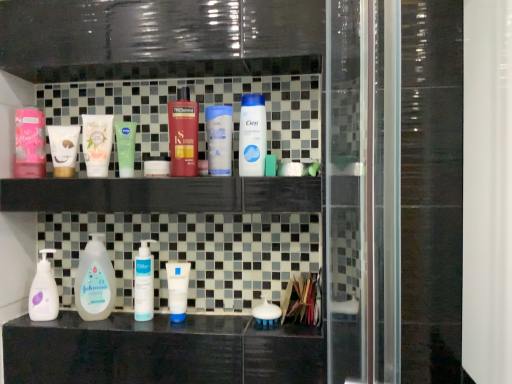
Question: Can you confirm if shiny red plastic bottle at center, which appears as the 2th cleaning product when viewed from the right, is taller than white glossy bottle at upper center, which appears as the 1th cleaning product when viewed from the right?

Choices:
 (A) yes
 (B) no

Answer: (A)

Question: From the image's perspective, would you say shiny red plastic bottle at center, the 4th cleaning product positioned from the left, is shown under white glossy bottle at upper center, which appears as the 1th cleaning product when viewed from the right?

Choices:
 (A) yes
 (B) no

Answer: (B)

Question: Is shiny red plastic bottle at center, the 4th cleaning product positioned from the left, next to white glossy bottle at upper center, which appears as the 1th cleaning product when viewed from the right, and touching it?

Choices:
 (A) no
 (B) yes

Answer: (A)

Question: Is shiny red plastic bottle at center, which appears as the 2th cleaning product when viewed from the right, oriented towards white glossy bottle at upper center, the fifth cleaning product viewed from the left?

Choices:
 (A) no
 (B) yes

Answer: (A)

Question: Does shiny red plastic bottle at center, which appears as the 2th cleaning product when viewed from the right, have a smaller size compared to white glossy bottle at upper center, the fifth cleaning product viewed from the left?

Choices:
 (A) yes
 (B) no

Answer: (B)

Question: From the image's perspective, is white matte johnson's baby lotion at lower left, the second cleaning product positioned from the left, positioned above or below white matte pump bottle at lower left, acting as the 5th cleaning product starting from the right?

Choices:
 (A) above
 (B) below

Answer: (A)

Question: Would you say white matte johnson's baby lotion at lower left, which is the 4th cleaning product in right-to-left order, is inside or outside white matte pump bottle at lower left, acting as the 5th cleaning product starting from the right?

Choices:
 (A) outside
 (B) inside

Answer: (A)

Question: Looking at the image, does white matte johnson's baby lotion at lower left, the second cleaning product positioned from the left, seem bigger or smaller compared to white matte pump bottle at lower left, the first cleaning product from the left?

Choices:
 (A) small
 (B) big

Answer: (B)

Question: Is point (74, 301) positioned closer to the camera than point (51, 311)?

Choices:
 (A) farther
 (B) closer

Answer: (A)

Question: In terms of width, does matte pink lotion at left, which ranks as the second toiletry in top-to-bottom order, look wider or thinner when compared to white matte tube at center, placed as the 1th mouthwash when sorted from bottom to top?

Choices:
 (A) wide
 (B) thin

Answer: (A)

Question: From a real-world perspective, relative to white matte tube at center, marked as the 1th mouthwash in a right-to-left arrangement, is matte pink lotion at left, the first toiletry when ordered from left to right, vertically above or below?

Choices:
 (A) above
 (B) below

Answer: (A)

Question: Is matte pink lotion at left, which ranks as the second toiletry in top-to-bottom order, inside the boundaries of white matte tube at center, marked as the 1th mouthwash in a right-to-left arrangement, or outside?

Choices:
 (A) outside
 (B) inside

Answer: (A)

Question: Does point (26, 175) appear closer or farther from the camera than point (172, 309)?

Choices:
 (A) farther
 (B) closer

Answer: (A)

Question: Choose the correct answer: Is matte green tube at center, the 3th mouthwash positioned from the right, inside white matte pump bottle at lower left, the first cleaning product from the left, or outside it?

Choices:
 (A) outside
 (B) inside

Answer: (A)

Question: Looking at the image, does matte green tube at center, positioned as the first mouthwash in left-to-right order, seem bigger or smaller compared to white matte pump bottle at lower left, the first cleaning product from the left?

Choices:
 (A) small
 (B) big

Answer: (B)